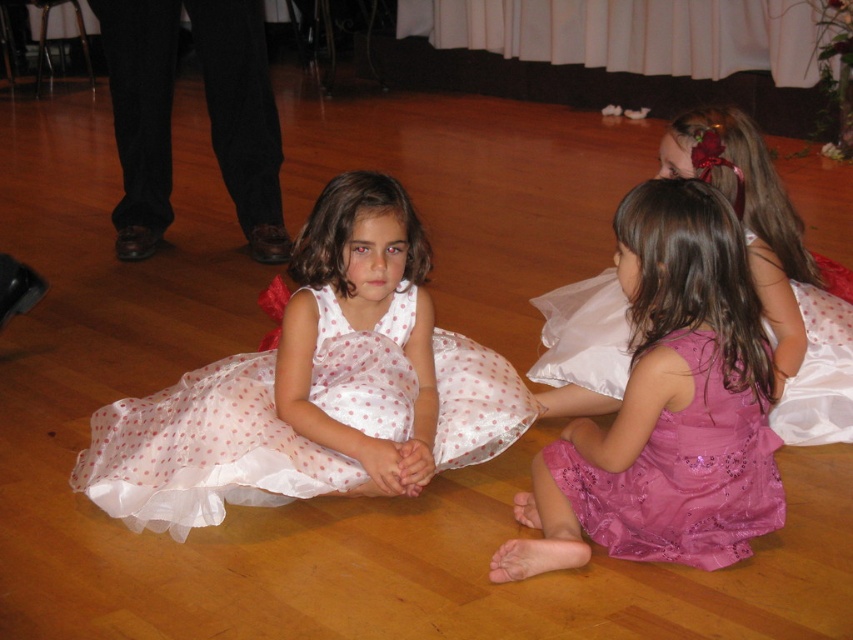
You are a photographer at the event and need to capture a closeup of the purple sequined dress at lower right and the pink sequined dress at lower right. Since you can only focus on one dress at a time, which dress should you adjust your camera to focus on first if you want to follow the natural left to right viewing order?

You should focus on the purple sequined dress at lower right first because it is positioned to the left of the pink sequined dress at lower right, following the natural left to right viewing order.

You are a photographer positioned at the back of the dance floor. You need to capture a photo that includes both the white sheer dress at center and the pink satin dress at lower right. Based on their positions, which dress should you adjust your camera angle to focus on first to ensure both are in frame?

The white sheer dress at center is located below the pink satin dress at lower right. To include both in the frame, you should first focus on the pink satin dress at lower right, as it is positioned higher up, and then adjust the angle downward to include the white sheer dress at center.

You are a photographer positioned at the front of the stage. You need to capture a clear shot of both the white sheer dress at center and the pink satin dress at lower right. Which dress should you focus on first to ensure both are in focus?

You should focus on the white sheer dress at center first since it is closer to the viewer. By focusing on the closer object, the depth of field may still capture the pink satin dress at lower right in the background. Alternatively, using a smaller aperture could help keep both in focus, but prioritizing the closer subject ensures clarity.